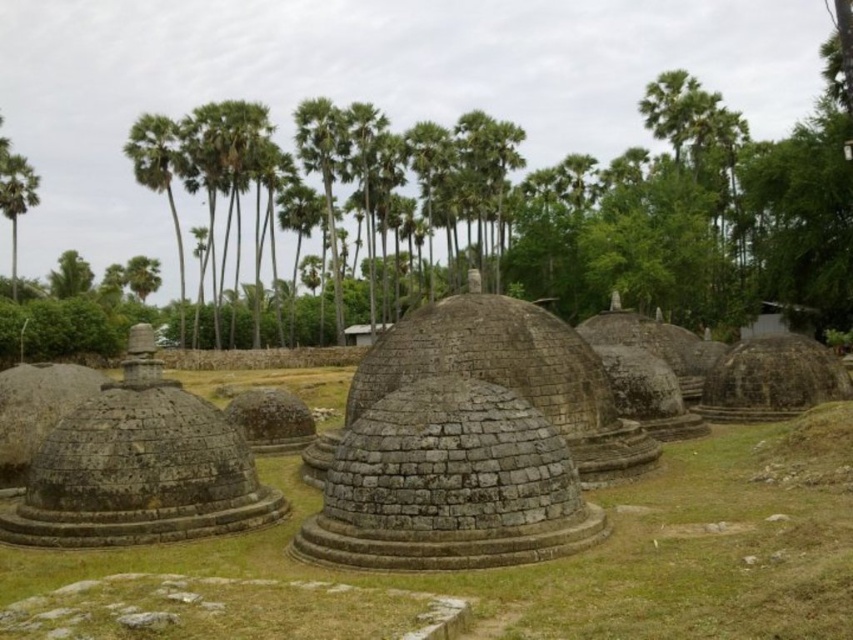
Question: Which is farther from the green leafy palm tree at center?

Choices:
 (A) gray stone hut at center
 (B) green grass at center
 (C) green leafy palm tree at upper left

Answer: (B)

Question: Among these objects, which one is nearest to the camera?

Choices:
 (A) green leafy palm tree at left
 (B) green grass at center
 (C) smooth gray stone hut at center
 (D) green leafy palm tree at upper left

Answer: (B)

Question: Which object is the closest to the green leafy palm tree at upper left?

Choices:
 (A) green leafy palm tree at left
 (B) green grass at center

Answer: (A)

Question: Is green leafy palm tree at upper left positioned in front of smooth gray stone hut at center?

Choices:
 (A) no
 (B) yes

Answer: (A)

Question: Does gray stone dome at center have a smaller size compared to green leafy palm tree at center?

Choices:
 (A) yes
 (B) no

Answer: (A)

Question: Considering the relative positions of gray stone dome at center and smooth gray stone hut at center in the image provided, where is gray stone dome at center located with respect to smooth gray stone hut at center?

Choices:
 (A) left
 (B) right

Answer: (A)